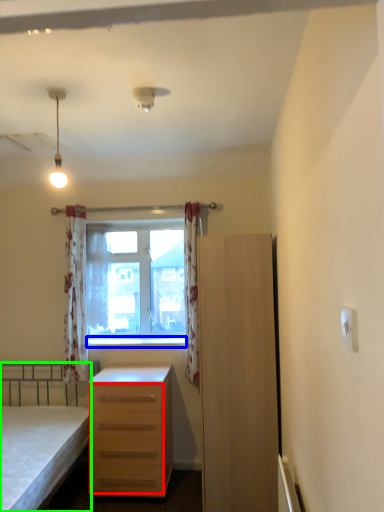
Question: Estimate the real-world distances between objects in this image. Which object is farther from drawer (highlighted by a red box), window sill (highlighted by a blue box) or bed (highlighted by a green box)?

Choices:
 (A) window sill
 (B) bed

Answer: (A)